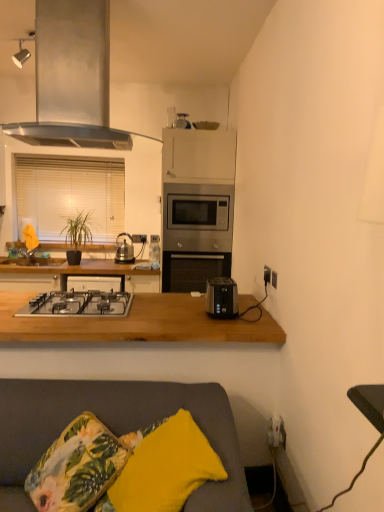
Image resolution: width=384 pixels, height=512 pixels. Identify the location of empty space that is ontop of shiny metallic kettle at center, arranged as the 1th appliance when viewed from the left (from a real-world perspective). (131, 240).